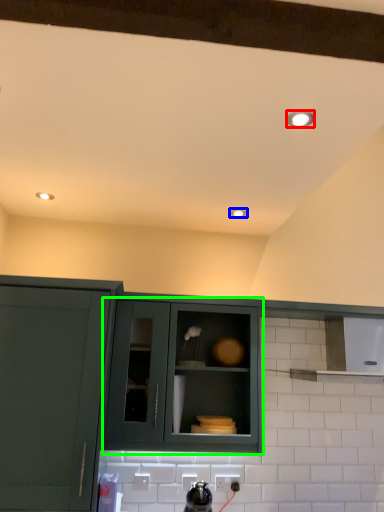
Question: Based on their relative distances, which object is nearer to light fixture (highlighted by a red box)? Choose from lighting (highlighted by a blue box) and cabinetry (highlighted by a green box).

Choices:
 (A) lighting
 (B) cabinetry

Answer: (A)